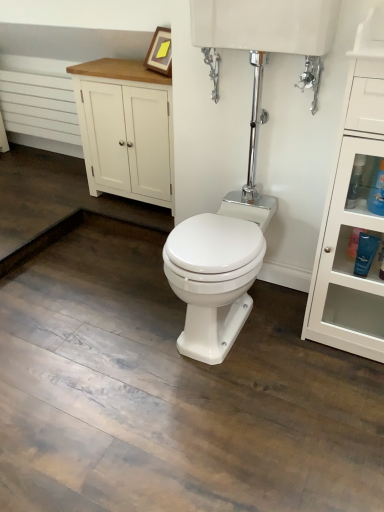
What are the coordinates of `free space to the left of white glossy cabinet at right` in the screenshot? It's located at (280, 342).